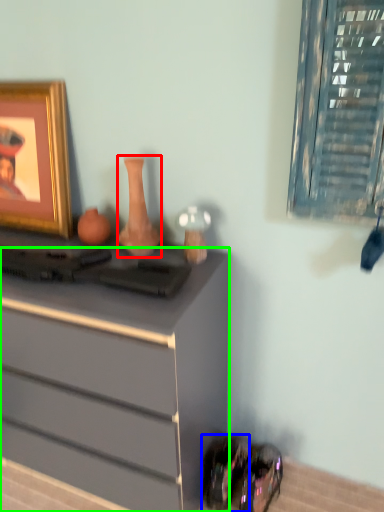
Question: Based on their relative distances, which object is nearer to vase (highlighted by a red box)? Choose from shoe (highlighted by a blue box) and chest of drawers (highlighted by a green box).

Choices:
 (A) shoe
 (B) chest of drawers

Answer: (B)